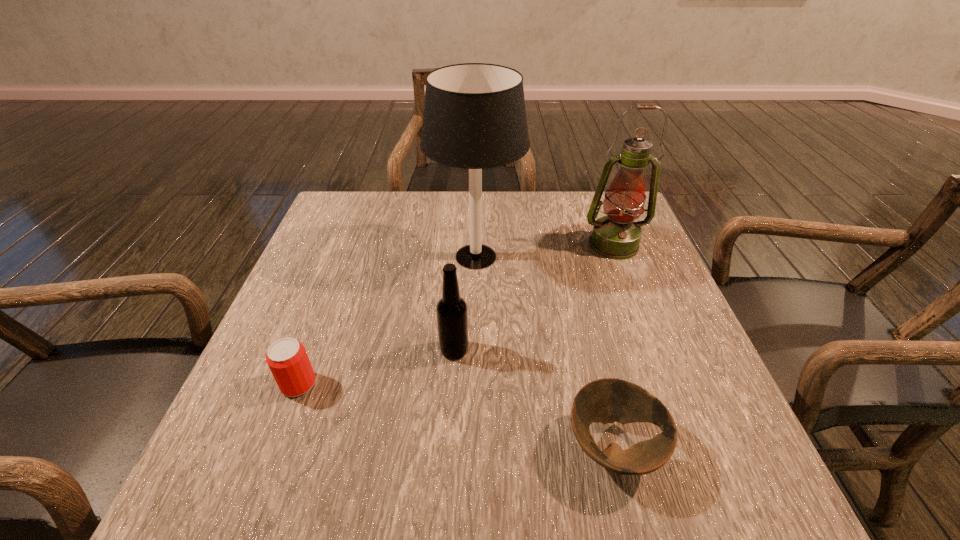
The image size is (960, 540). Find the location of `the tallest object`. the tallest object is located at coordinates (474, 118).

Find the location of a particular element. oil lamp is located at coordinates (616, 236).

What are the coordinates of `the third nearest object` in the screenshot? It's located at (452, 317).

The height and width of the screenshot is (540, 960). Find the location of `beer bottle`. beer bottle is located at coordinates (452, 317).

Where is `the leftmost object`? The image size is (960, 540). the leftmost object is located at coordinates (287, 358).

The height and width of the screenshot is (540, 960). I want to click on beer can, so click(x=287, y=358).

Where is `the shortest object`? Image resolution: width=960 pixels, height=540 pixels. the shortest object is located at coordinates pos(608,400).

Image resolution: width=960 pixels, height=540 pixels. I want to click on bowl, so click(608, 400).

You are a GUI agent. You are given a task and a screenshot of the screen. Output one action in this format:
    pyautogui.click(x=<x>, y=<y>)
    Task: Click on the free space located on the right of the tallest object
    The height and width of the screenshot is (540, 960).
    Given the screenshot: What is the action you would take?
    pyautogui.click(x=549, y=256)

The width and height of the screenshot is (960, 540). In order to click on vacant region located 0.130m on the front of the oil lamp in this screenshot , I will do `click(634, 296)`.